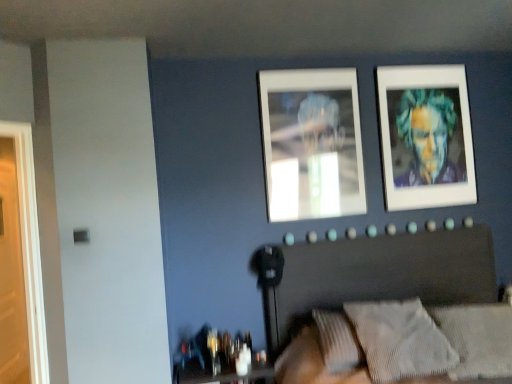
Question: Does textured gray headboard at center have a smaller size compared to textured gray pillow at lower right, marked as the 1th pillow in a right-to-left arrangement?

Choices:
 (A) yes
 (B) no

Answer: (B)

Question: From the image's perspective, is textured gray headboard at center on textured gray pillow at lower right, marked as the 1th pillow in a right-to-left arrangement?

Choices:
 (A) yes
 (B) no

Answer: (B)

Question: Is the position of textured gray headboard at center more distant than that of textured gray pillow at lower right, arranged as the 2th pillow when viewed from the left?

Choices:
 (A) yes
 (B) no

Answer: (B)

Question: Is textured gray headboard at center positioned in front of textured gray pillow at lower right, marked as the 1th pillow in a right-to-left arrangement?

Choices:
 (A) no
 (B) yes

Answer: (B)

Question: Does textured gray headboard at center have a lesser height compared to textured gray pillow at lower right, marked as the 1th pillow in a right-to-left arrangement?

Choices:
 (A) no
 (B) yes

Answer: (A)

Question: Is metallic reflective frame at upper center, placed as the 2th picture frame when sorted from right to left, in front of or behind textured gray headboard at center in the image?

Choices:
 (A) behind
 (B) front

Answer: (A)

Question: In terms of height, does metallic reflective frame at upper center, which is counted as the 1th picture frame, starting from the left, look taller or shorter compared to textured gray headboard at center?

Choices:
 (A) short
 (B) tall

Answer: (A)

Question: In the image, is metallic reflective frame at upper center, acting as the first picture frame starting from the front, on the left side or the right side of textured gray headboard at center?

Choices:
 (A) right
 (B) left

Answer: (B)

Question: Is metallic reflective frame at upper center, placed as the 2th picture frame when sorted from right to left, wider or thinner than textured gray headboard at center?

Choices:
 (A) wide
 (B) thin

Answer: (B)

Question: Considering the positions of translucent glass table at lower center and textured gray pillow at lower right, arranged as the 1th pillow when viewed from the left, in the image, is translucent glass table at lower center bigger or smaller than textured gray pillow at lower right, arranged as the 1th pillow when viewed from the left,?

Choices:
 (A) big
 (B) small

Answer: (B)

Question: Considering the positions of translucent glass table at lower center and textured gray pillow at lower right, arranged as the 1th pillow when viewed from the left, in the image, is translucent glass table at lower center wider or thinner than textured gray pillow at lower right, arranged as the 1th pillow when viewed from the left,?

Choices:
 (A) wide
 (B) thin

Answer: (B)

Question: Relative to textured gray pillow at lower right, arranged as the 1th pillow when viewed from the left, is translucent glass table at lower center in front or behind?

Choices:
 (A) front
 (B) behind

Answer: (B)

Question: Do you think translucent glass table at lower center is within textured gray pillow at lower right, arranged as the 1th pillow when viewed from the left, or outside of it?

Choices:
 (A) inside
 (B) outside

Answer: (B)

Question: Visually, is textured gray headboard at center positioned to the left or to the right of metallic reflective frame at upper center, acting as the first picture frame starting from the front?

Choices:
 (A) left
 (B) right

Answer: (B)

Question: Choose the correct answer: Is textured gray headboard at center inside metallic reflective frame at upper center, which is counted as the 1th picture frame, starting from the left, or outside it?

Choices:
 (A) outside
 (B) inside

Answer: (A)